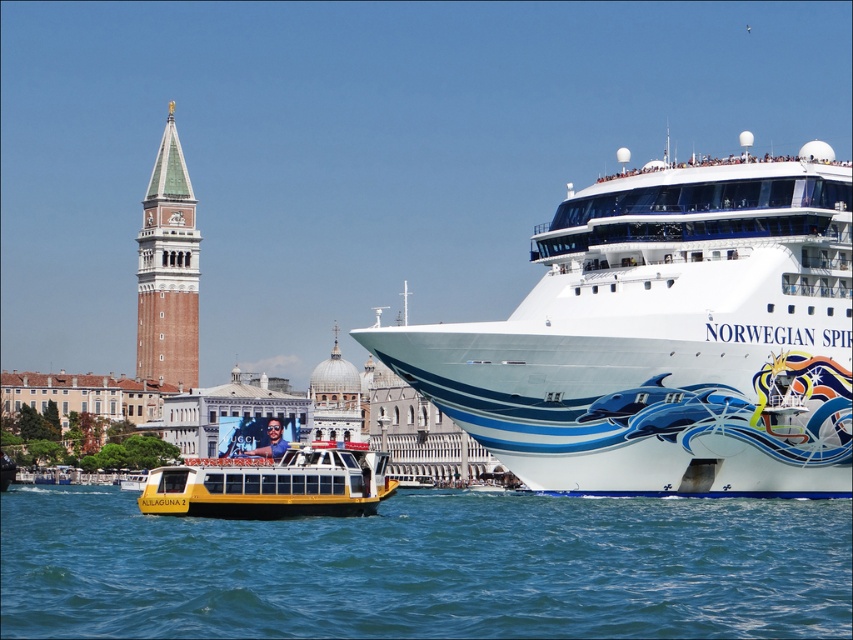
Question: Can you confirm if blue water at lower left is positioned to the left of brick stonework bell tower at upper left?

Choices:
 (A) yes
 (B) no

Answer: (B)

Question: Which point is closer to the camera?

Choices:
 (A) pos(15,618)
 (B) pos(183,172)
 (C) pos(643,342)
 (D) pos(221,513)

Answer: (A)

Question: Can you confirm if white glossy cruise ship at right is thinner than yellow matte/glossy boat at center?

Choices:
 (A) no
 (B) yes

Answer: (A)

Question: Does blue water at lower left have a lesser width compared to brick stonework bell tower at upper left?

Choices:
 (A) no
 (B) yes

Answer: (A)

Question: Which object is the closest to the brick stonework bell tower at upper left?

Choices:
 (A) yellow matte/glossy boat at center
 (B) white glossy cruise ship at right
 (C) blue water at lower left

Answer: (A)

Question: Among these objects, which one is farthest from the camera?

Choices:
 (A) blue water at lower left
 (B) yellow matte/glossy boat at center
 (C) brick stonework bell tower at upper left

Answer: (C)